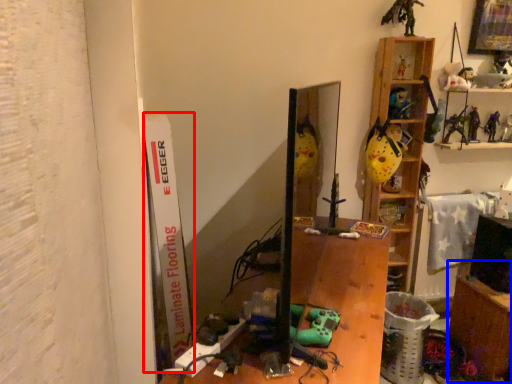
Question: Which object is further to the camera taking this photo, bulletin board (highlighted by a red box) or table (highlighted by a blue box)?

Choices:
 (A) bulletin board
 (B) table

Answer: (B)